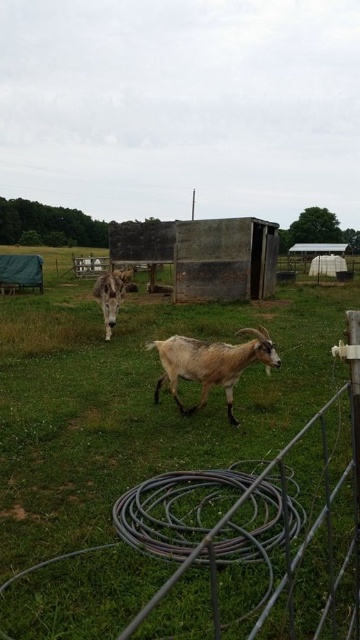
You are standing in the farm scene and see the brown fuzzy goat at center and the brown woolen goat at center. Which goat is positioned to the right side?

The brown fuzzy goat at center is positioned to the right of the brown woolen goat at center.

You are a farmer checking the field. You see the green grassy field at center and the brown fuzzy goat at center. Which one takes up more space in the image?

The green grassy field at center is bigger than the brown fuzzy goat at center, so it takes up more space in the image.